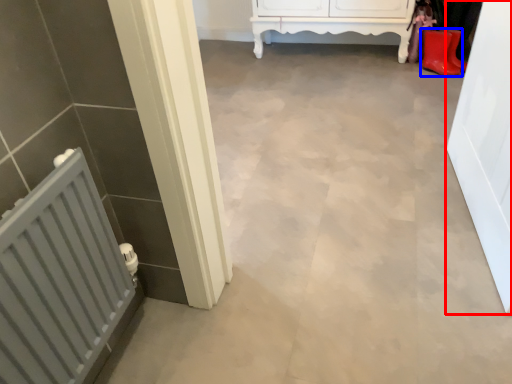
Question: Among these objects, which one is nearest to the camera, door (highlighted by a red box) or footwear (highlighted by a blue box)?

Choices:
 (A) door
 (B) footwear

Answer: (A)